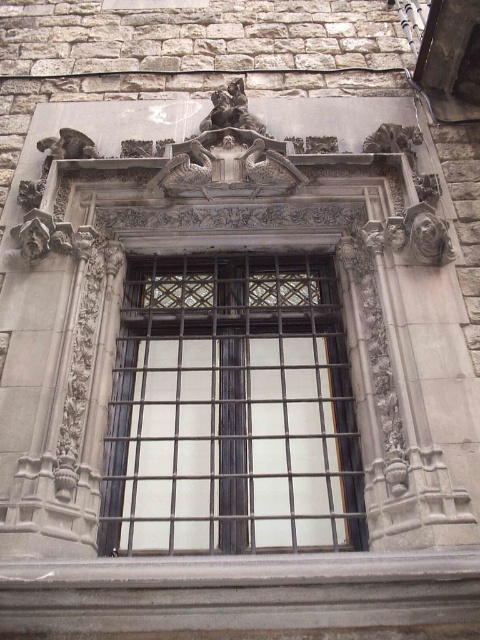
Question: Among these points, which one is nearest to the camera?

Choices:
 (A) (227, 122)
 (B) (37, 141)
 (C) (158, 481)
 (D) (205, 172)

Answer: (C)

Question: Based on their relative distances, which object is farther from the dark gray stone gargoyle at upper left?

Choices:
 (A) polished bronze statue at upper center
 (B) gray stone gargoyle at upper center
 (C) metallic grid window at center

Answer: (C)

Question: Which object appears closest to the camera in this image?

Choices:
 (A) polished bronze statue at upper center
 (B) gray stone gargoyle at upper center
 (C) metallic grid window at center

Answer: (C)

Question: Can you confirm if polished bronze statue at upper center is positioned to the right of dark gray stone gargoyle at upper left?

Choices:
 (A) no
 (B) yes

Answer: (B)

Question: Can you confirm if gray stone gargoyle at upper center is smaller than dark gray stone gargoyle at upper left?

Choices:
 (A) no
 (B) yes

Answer: (B)

Question: Is metallic grid window at center to the right of polished bronze statue at upper center from the viewer's perspective?

Choices:
 (A) no
 (B) yes

Answer: (B)